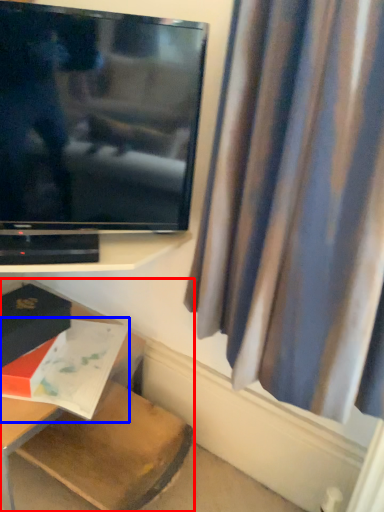
Question: Which point is closer to the camera, furniture (highlighted by a red box) or book (highlighted by a blue box)?

Choices:
 (A) furniture
 (B) book

Answer: (A)